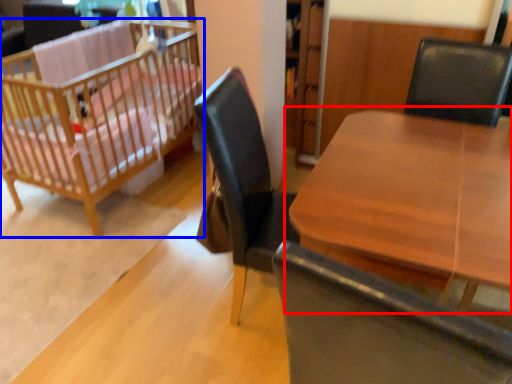
Question: Which point is further to the camera, table (highlighted by a red box) or infant bed (highlighted by a blue box)?

Choices:
 (A) table
 (B) infant bed

Answer: (B)